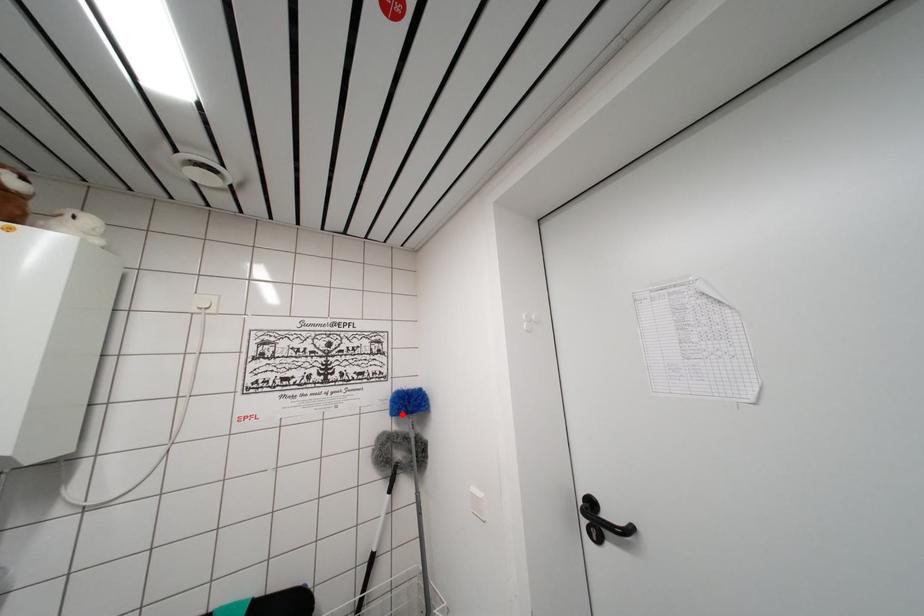
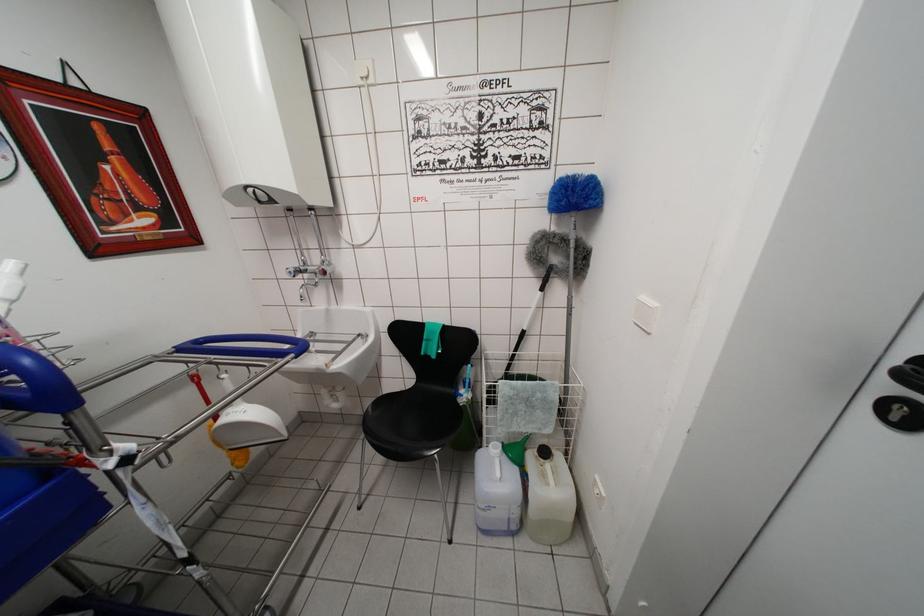
Find the pixel in the second image that matches the highlighted location in the first image.

(562, 206)